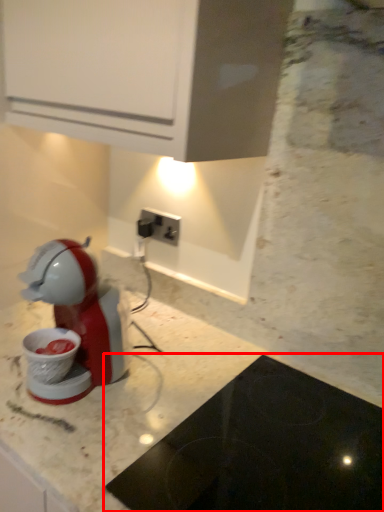
Question: Considering the relative positions of home appliance (annotated by the red box) and power plugs and sockets in the image provided, where is home appliance (annotated by the red box) located with respect to the staircase?

Choices:
 (A) left
 (B) right

Answer: (B)